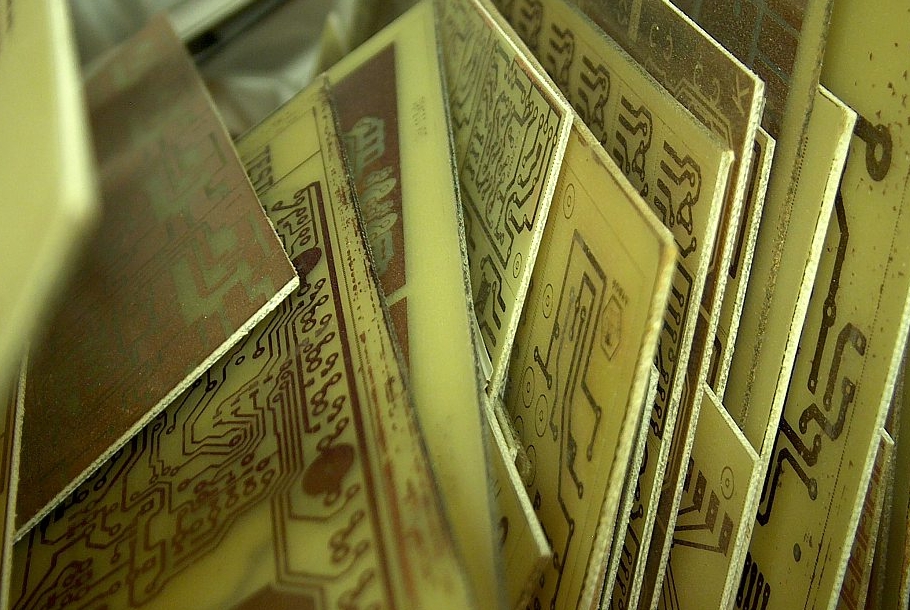
You are a GUI agent. You are given a task and a screenshot of the screen. Output one action in this format:
    pyautogui.click(x=<x>, y=<y>)
    Task: Click on the blurry radio board on the far left
    
    Given the screenshot: What is the action you would take?
    pyautogui.click(x=57, y=204)